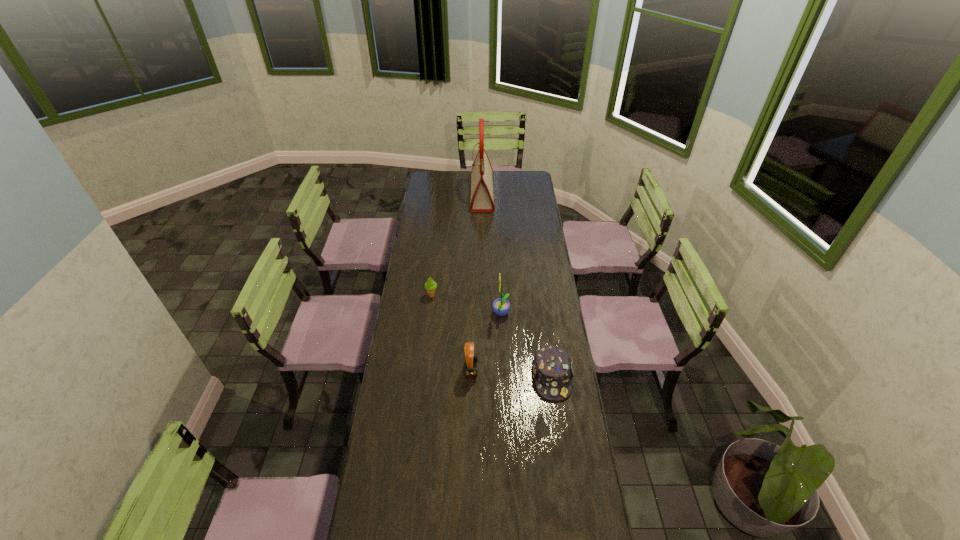
Identify the location of empty space that is in between the farthest object and the headset. coord(477,282).

The image size is (960, 540). In order to click on empty space that is in between the shortest object and the fourth tallest object in this screenshot , I will do `click(492, 336)`.

Locate an element on the screen. Image resolution: width=960 pixels, height=540 pixels. free point between the fourth shortest object and the farthest object is located at coordinates (492, 254).

Point out which object is positioned as the third nearest to the headset. Please provide its 2D coordinates. Your answer should be formatted as a tuple, i.e. [(x, y)], where the tuple contains the x and y coordinates of a point satisfying the conditions above.

[(430, 285)]

Where is `the closest object to the headset`? The width and height of the screenshot is (960, 540). the closest object to the headset is located at coordinates (501, 306).